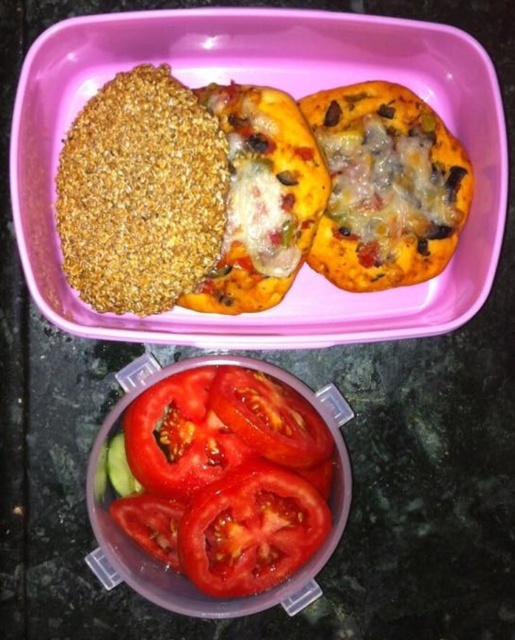
Question: Considering the relative positions of sliced red tomato at center and sliced red tomato at lower center in the image provided, where is sliced red tomato at center located with respect to sliced red tomato at lower center?

Choices:
 (A) above
 (B) below

Answer: (A)

Question: Can you confirm if sliced red tomato at center is positioned to the left of sliced red tomato at lower center?

Choices:
 (A) yes
 (B) no

Answer: (B)

Question: Which object is farther from the camera taking this photo?

Choices:
 (A) sliced red tomato at lower center
 (B) red matte tomato at lower center
 (C) sliced red tomato at center

Answer: (A)

Question: Which point is closer to the camera?

Choices:
 (A) (321, 461)
 (B) (247, 472)

Answer: (B)

Question: Can you confirm if sliced red tomato at center is smaller than sliced red tomato at lower center?

Choices:
 (A) no
 (B) yes

Answer: (A)

Question: Which object is positioned closest to the sliced red tomato at center?

Choices:
 (A) sliced red tomato at lower center
 (B) red matte tomato at center

Answer: (B)